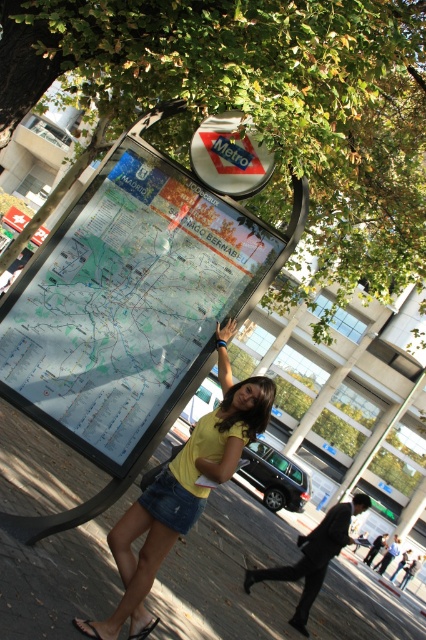
Question: Can you confirm if green leafy tree at upper center is thinner than yellow matte shirt at center?

Choices:
 (A) yes
 (B) no

Answer: (B)

Question: Which of the following is the farthest from the observer?

Choices:
 (A) (138, 28)
 (B) (221, 193)
 (C) (69, 376)
 (D) (166, 490)

Answer: (A)

Question: Is yellow matte shirt at center thinner than white glossy sign at upper center?

Choices:
 (A) yes
 (B) no

Answer: (B)

Question: Which object appears closest to the camera in this image?

Choices:
 (A) transparent glass map at center
 (B) white glossy sign at upper center
 (C) yellow matte shirt at center
 (D) green leafy tree at upper center

Answer: (C)

Question: Does green leafy tree at upper center appear under transparent glass map at center?

Choices:
 (A) no
 (B) yes

Answer: (A)

Question: Which point is closer to the camera taking this photo?

Choices:
 (A) (46, 422)
 (B) (307, 106)
 (C) (126, 561)

Answer: (C)